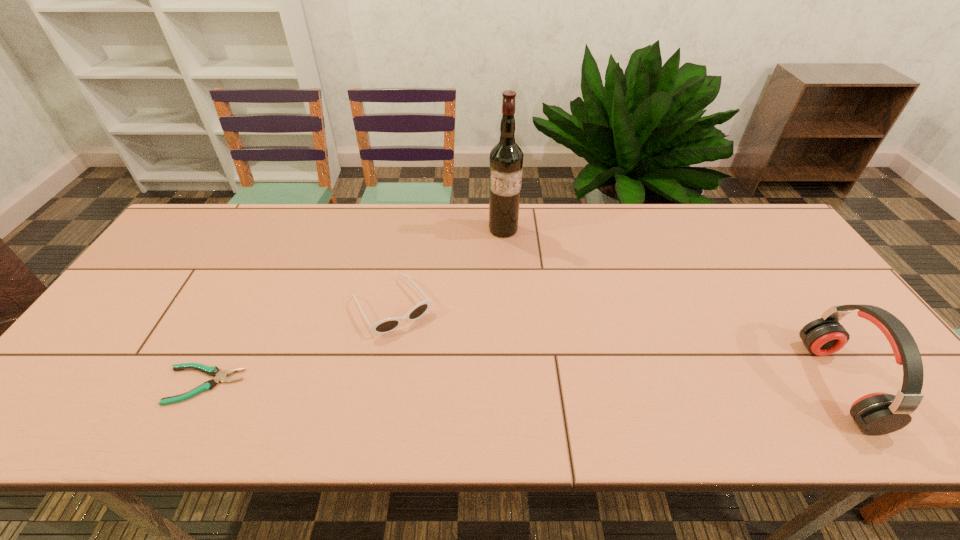
This screenshot has width=960, height=540. I want to click on free space on the desktop that is between the pliers and the earphone and is positioned with the lenses of the second farthest object facing outward, so click(x=447, y=384).

Locate an element on the screen. The image size is (960, 540). free space on the desktop that is between the leftmost object and the second tallest object and is positioned on the front and back of the tallest object is located at coordinates (509, 384).